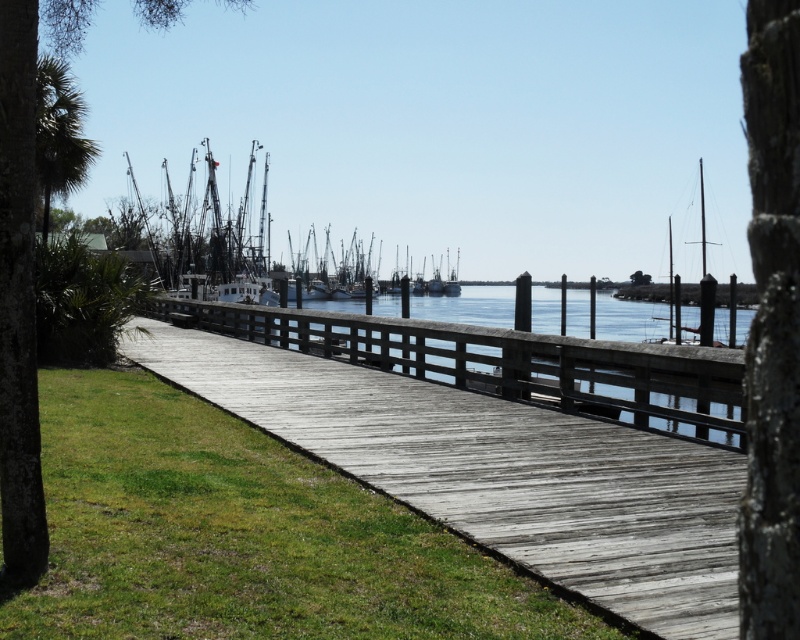
Question: Among these objects, which one is nearest to the camera?

Choices:
 (A) green grass at lower left
 (B) white matte boat at center

Answer: (A)

Question: Is white matte boat at center further to the viewer compared to green leafy palm tree at upper left?

Choices:
 (A) yes
 (B) no

Answer: (A)

Question: Is green grass at lower left to the left of green leafy palm tree at upper left from the viewer's perspective?

Choices:
 (A) no
 (B) yes

Answer: (A)

Question: Which point is farther from the camera taking this photo?

Choices:
 (A) (712, 289)
 (B) (308, 292)
 (C) (38, 83)
 (D) (306, 611)

Answer: (B)

Question: In this image, where is white matte boat at center located relative to smooth white sailboat at right?

Choices:
 (A) right
 (B) left

Answer: (B)

Question: Which point is farther to the camera?

Choices:
 (A) green leafy palm tree at upper left
 (B) green grass at lower left
 (C) white matte boat at center

Answer: (C)